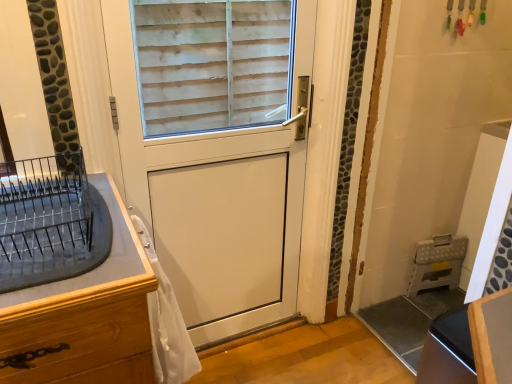
Question: Is black glossy vanity at lower right bigger or smaller than white sheer fabric at lower left?

Choices:
 (A) small
 (B) big

Answer: (B)

Question: Relative to white sheer fabric at lower left, is black glossy vanity at lower right in front or behind?

Choices:
 (A) behind
 (B) front

Answer: (A)

Question: Which object is positioned closest to the white sheer fabric at lower left?

Choices:
 (A) black glossy vanity at lower right
 (B) white plastic folding stool at lower right, which ranks as the 2th appliance in left-to-right order
 (C) white matte door at center
 (D) black metal dish rack at left, the 1th appliance positioned from the front

Answer: (D)

Question: Estimate the real-world distances between objects in this image. Which object is farther from the black glossy vanity at lower right?

Choices:
 (A) white sheer fabric at lower left
 (B) white matte door at center
 (C) white plastic folding stool at lower right, which ranks as the 2th appliance in left-to-right order
 (D) black metal dish rack at left, which is counted as the 2th appliance, starting from the back

Answer: (C)